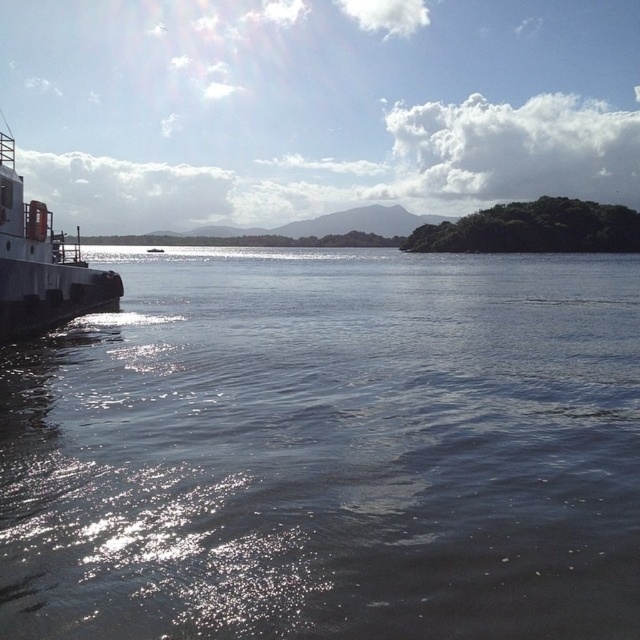
Can you confirm if dark blue water at lower left is bigger than metallic gray boat at left?

Correct, dark blue water at lower left is larger in size than metallic gray boat at left.

Is point (483, 502) closer to viewer compared to point (93, 282)?

That is True.

The width and height of the screenshot is (640, 640). What do you see at coordinates (328, 451) in the screenshot? I see `dark blue water at lower left` at bounding box center [328, 451].

You are a GUI agent. You are given a task and a screenshot of the screen. Output one action in this format:
    pyautogui.click(x=<x>, y=<y>)
    Task: Click on the dark blue water at lower left
    Image resolution: width=640 pixels, height=640 pixels.
    Given the screenshot: What is the action you would take?
    pyautogui.click(x=328, y=451)